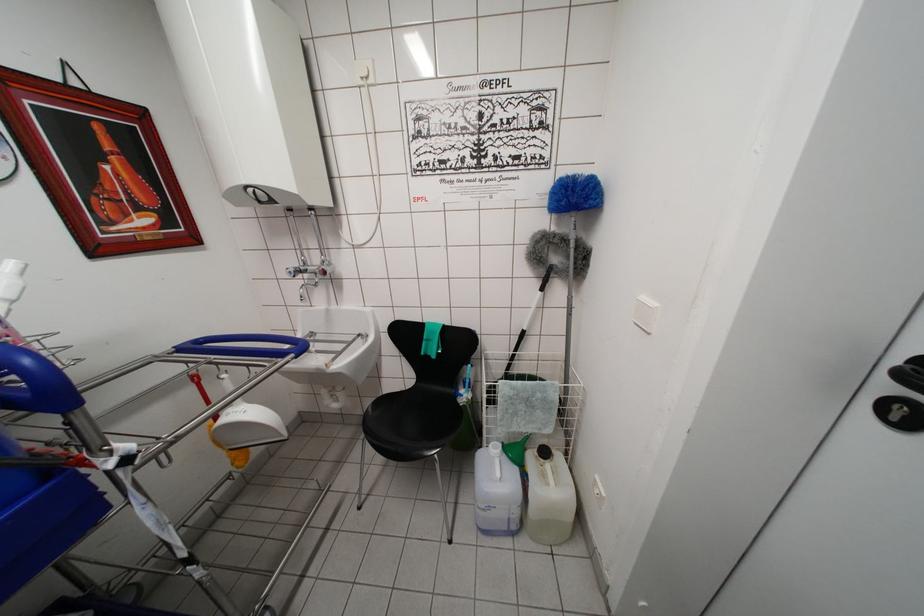
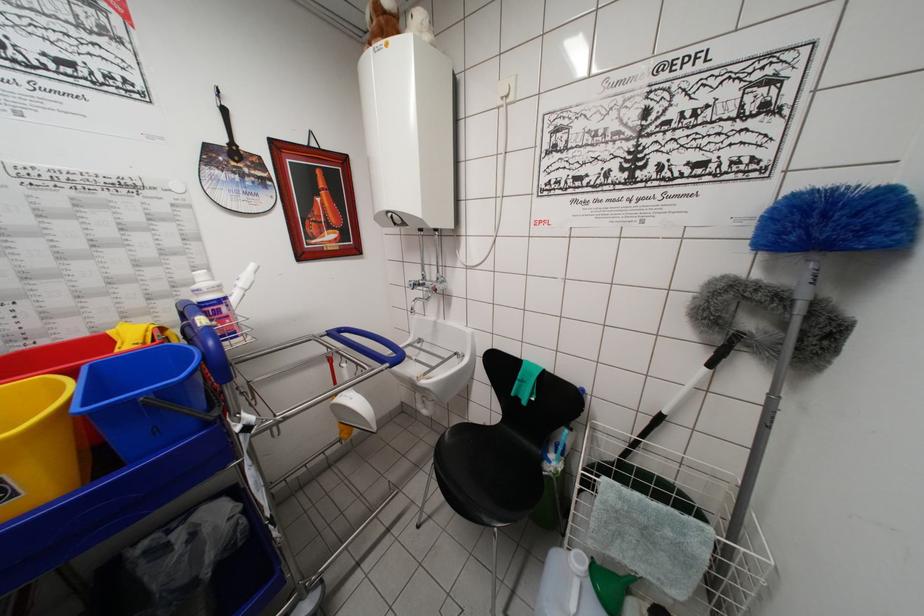
Find the pixel in the second image that matches (x=508, y=448) in the first image.

(601, 565)